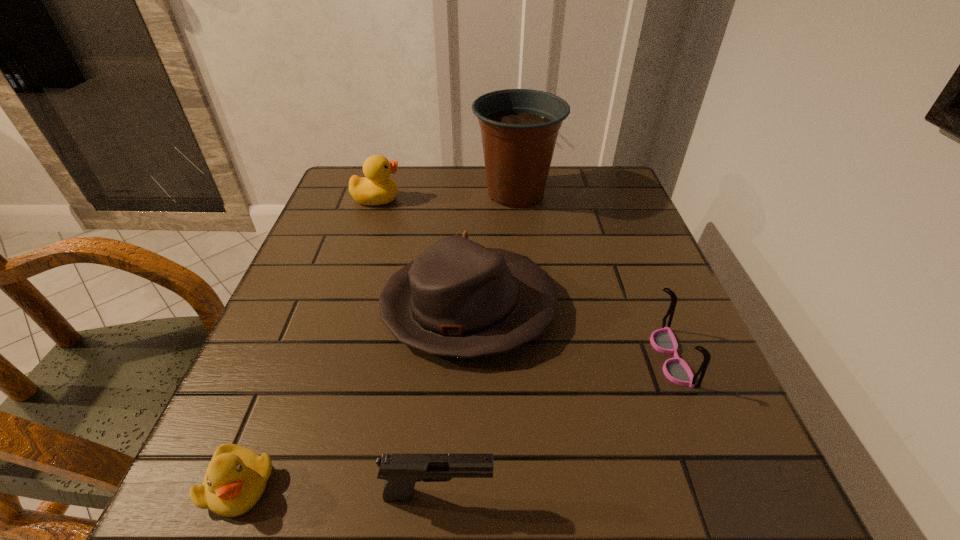
Find the location of a particular element. Image resolution: width=960 pixels, height=540 pixels. vacant space at the far edge of the desktop is located at coordinates (557, 177).

This screenshot has width=960, height=540. Identify the location of vacant space at the left edge of the desktop. (362, 243).

In the image, there is a desktop. At what (x,y) coordinates should I click in order to perform the action: click on free region at the right edge. Please return your answer as a coordinate pair (x, y). The height and width of the screenshot is (540, 960). Looking at the image, I should click on point(681,301).

At what (x,y) coordinates should I click in order to perform the action: click on free point at the near right corner. Please return your answer as a coordinate pair (x, y). Looking at the image, I should click on (775, 502).

Where is `vacant region between the pistol and the duckling`? Image resolution: width=960 pixels, height=540 pixels. vacant region between the pistol and the duckling is located at coordinates (339, 489).

I want to click on free space between the pistol and the hat, so click(x=453, y=401).

The width and height of the screenshot is (960, 540). What are the coordinates of `free space that is in between the hat and the pistol` in the screenshot? It's located at (453, 401).

Where is `vacant point located between the hat and the shortest object`? The image size is (960, 540). vacant point located between the hat and the shortest object is located at coordinates (354, 396).

Image resolution: width=960 pixels, height=540 pixels. In order to click on free space between the duck and the tallest object in this screenshot , I will do `click(446, 196)`.

Image resolution: width=960 pixels, height=540 pixels. In order to click on free space between the hat and the spectacles in this screenshot , I will do coord(570,332).